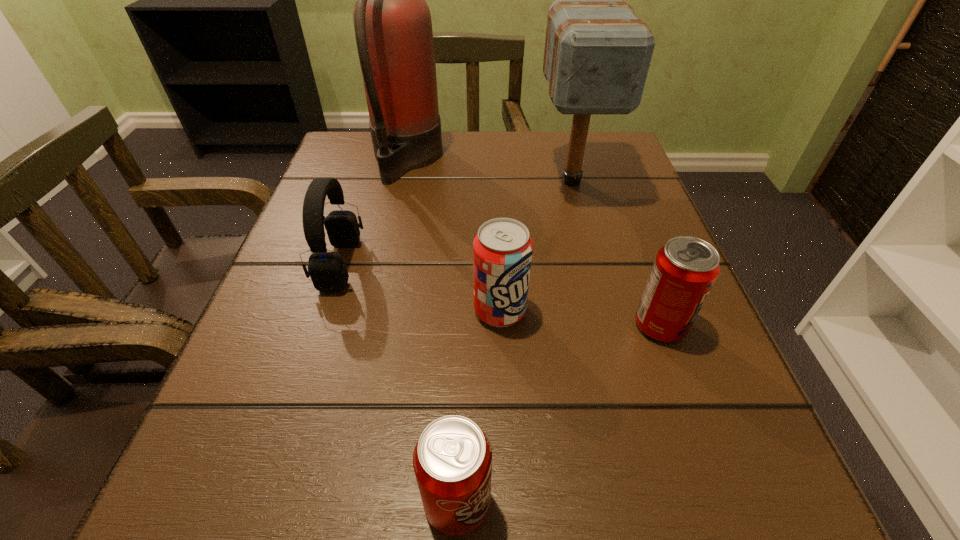
The width and height of the screenshot is (960, 540). What are the coordinates of `vacant space at the far left corner` in the screenshot? It's located at (372, 177).

At what (x,y) coordinates should I click in order to perform the action: click on free region at the near left corner of the desktop. Please return your answer as a coordinate pair (x, y). This screenshot has height=540, width=960. Looking at the image, I should click on (275, 514).

In the image, there is a desktop. Find the location of `vacant space at the far right corner`. vacant space at the far right corner is located at coordinates (615, 152).

The width and height of the screenshot is (960, 540). Identify the location of vacant region at the near right corner. (739, 475).

Where is `blank region between the mallet and the headset`? This screenshot has width=960, height=540. blank region between the mallet and the headset is located at coordinates (456, 222).

Locate an element on the screen. This screenshot has width=960, height=540. free space between the rightmost soda and the tallest object is located at coordinates (534, 242).

Identify which object is the second nearest to the headset. Please provide its 2D coordinates. Your answer should be formatted as a tuple, i.e. [(x, y)], where the tuple contains the x and y coordinates of a point satisfying the conditions above.

[(502, 250)]

You are a GUI agent. You are given a task and a screenshot of the screen. Output one action in this format:
    pyautogui.click(x=<x>, y=<y>)
    Task: Click on the closest object to the rightmost soda
    The width and height of the screenshot is (960, 540).
    Given the screenshot: What is the action you would take?
    pyautogui.click(x=502, y=250)

Where is `the third closest soda to the tallest object`? The width and height of the screenshot is (960, 540). the third closest soda to the tallest object is located at coordinates (452, 460).

Where is `soda that is the nearest to the nearest object`? The height and width of the screenshot is (540, 960). soda that is the nearest to the nearest object is located at coordinates (502, 250).